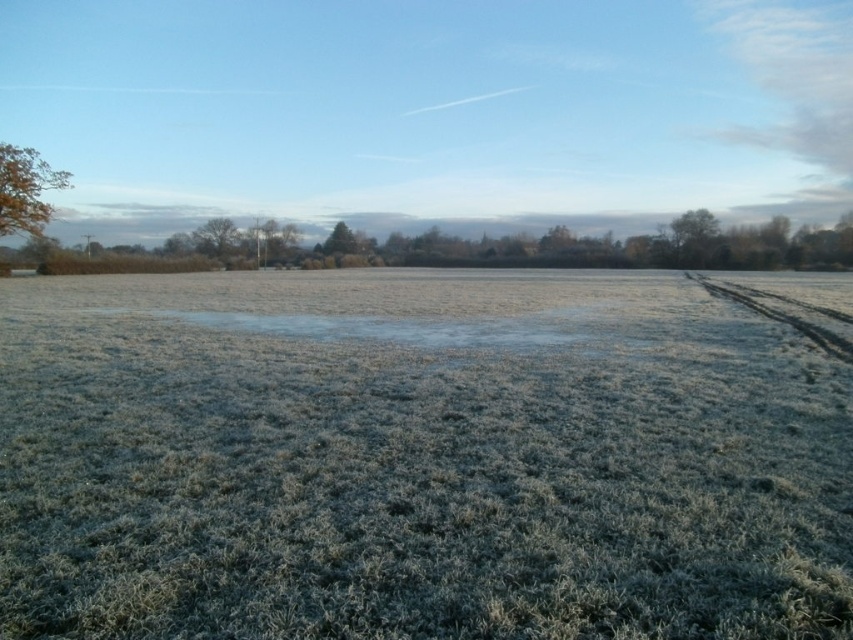
You are standing in the frosty field and want to pick up the golden brown leaves at upper left and the green textured tree at center. Which object is closer to your left side?

The golden brown leaves at upper left are to the left of the green textured tree at center, so they are closer to your left side.